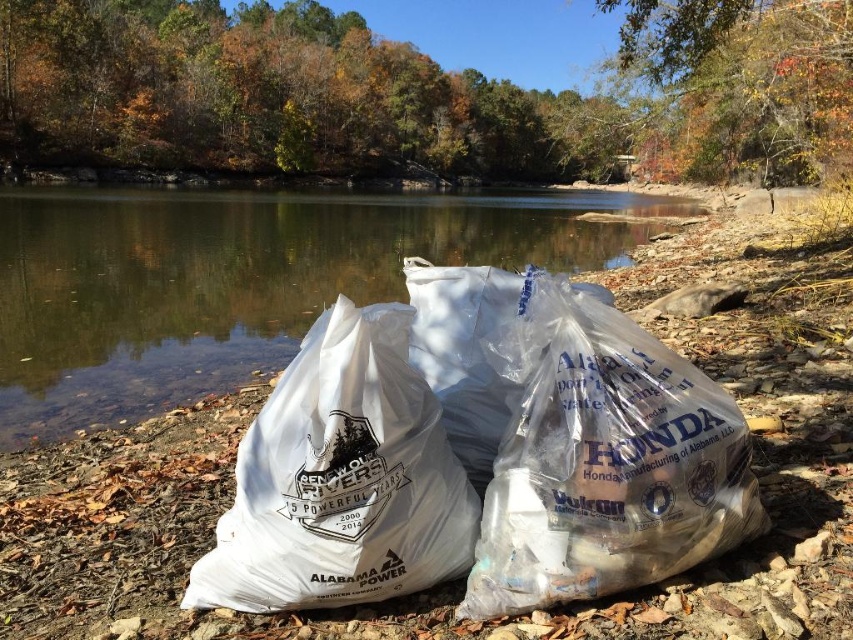
Who is more forward, (325, 324) or (376, 374)?

Point (376, 374)

Between white plastic bags at center and white plastic bag at center, which one is positioned lower?

white plastic bag at center

Is point (721, 392) less distant than point (358, 445)?

No, it is behind (358, 445).

Identify the location of white plastic bags at center. (479, 456).

Between white plastic bags at center and transparent plastic bags at center, which one appears on the right side from the viewer's perspective?

white plastic bags at center

Is point (486, 417) farther from viewer compared to point (33, 339)?

No, it is in front of (33, 339).

This screenshot has height=640, width=853. Identify the location of white plastic bags at center. (479, 456).

Which of these two, transparent plastic bags at center or white plastic bag at center, stands shorter?

With less height is white plastic bag at center.

Based on the photo, how far apart are transparent plastic bags at center and white plastic bag at center?

A distance of 9.77 meters exists between transparent plastic bags at center and white plastic bag at center.

This screenshot has width=853, height=640. Describe the element at coordinates (238, 280) in the screenshot. I see `transparent plastic bags at center` at that location.

You are a GUI agent. You are given a task and a screenshot of the screen. Output one action in this format:
    pyautogui.click(x=<x>, y=<y>)
    Task: Click on the transparent plastic bags at center
    The height and width of the screenshot is (640, 853).
    Given the screenshot: What is the action you would take?
    pyautogui.click(x=238, y=280)